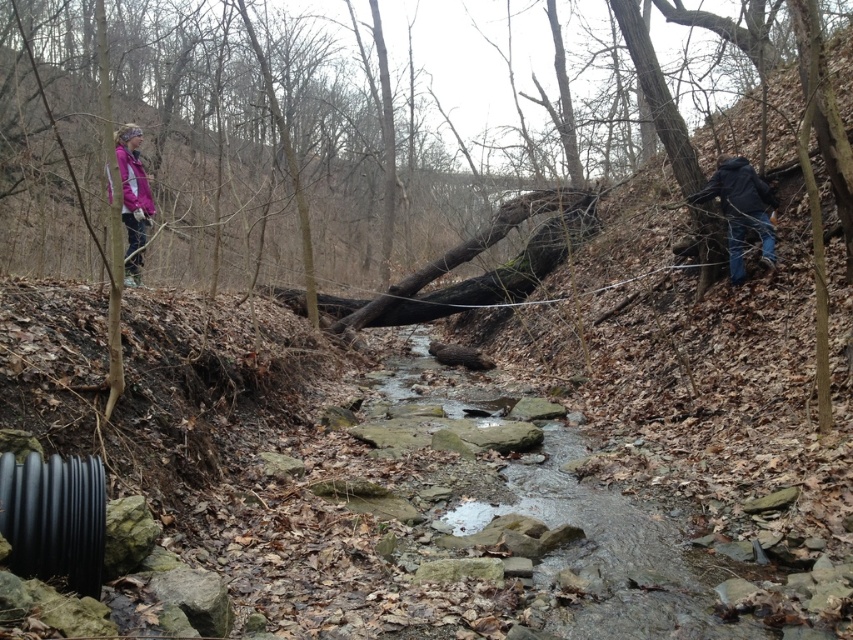
Can you confirm if dark blue jeans at right is positioned to the right of matte purple jacket at upper left?

Yes, dark blue jeans at right is to the right of matte purple jacket at upper left.

Who is lower down, dark blue jeans at right or matte purple jacket at upper left?

dark blue jeans at right

Is point (729, 240) farther from camera compared to point (152, 205)?

Yes, point (729, 240) is farther from viewer.

Where is `dark blue jeans at right`? The image size is (853, 640). dark blue jeans at right is located at coordinates (740, 209).

Who is shorter, pink fleece jacket at upper left or dark blue jacket at right?

With less height is dark blue jacket at right.

Between pink fleece jacket at upper left and dark blue jacket at right, which one is positioned lower?

pink fleece jacket at upper left is below.

The image size is (853, 640). What are the coordinates of `pink fleece jacket at upper left` in the screenshot? It's located at (132, 198).

Between clear water stream at center and pink fleece jacket at upper left, which one is positioned lower?

clear water stream at center is below.

Between clear water stream at center and pink fleece jacket at upper left, which one has less height?

With less height is clear water stream at center.

Between point (650, 502) and point (126, 134), which one is positioned behind?

The point (126, 134) is behind.

Locate an element on the screen. The width and height of the screenshot is (853, 640). clear water stream at center is located at coordinates (610, 552).